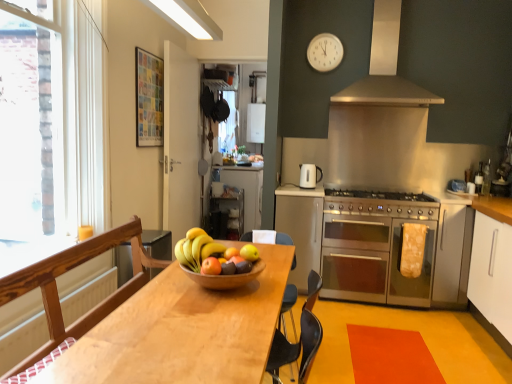
Question: Is point (210, 256) positioned closer to the camera than point (301, 165)?

Choices:
 (A) closer
 (B) farther

Answer: (A)

Question: Considering the relative positions of matte orange apple at center, the 2th apple viewed from the back, and white glossy electric kettle at upper center in the image provided, is matte orange apple at center, the 2th apple viewed from the back, to the left or to the right of white glossy electric kettle at upper center?

Choices:
 (A) left
 (B) right

Answer: (A)

Question: Which object is the closest to the metallic silver oven at center-right, the second appliance in the back-to-front sequence?

Choices:
 (A) light brown wooden table at center
 (B) stainless steel gas stove at center
 (C) yellow fabric oven mitt at right
 (D) white glossy cabinet at center, which appears as the first cabinetry when viewed from the left
 (E) white plastic clock at upper center

Answer: (B)

Question: Estimate the real-world distances between objects in this image. Which object is farther from the wooden bowl of fruit at center?

Choices:
 (A) yellow matte bananas at center
 (B) matte orange apple at center, which appears as the 2th apple when viewed from the right
 (C) stainless steel oven at center right
 (D) transparent glass window at left
 (E) yellow fabric oven mitt at right

Answer: (E)